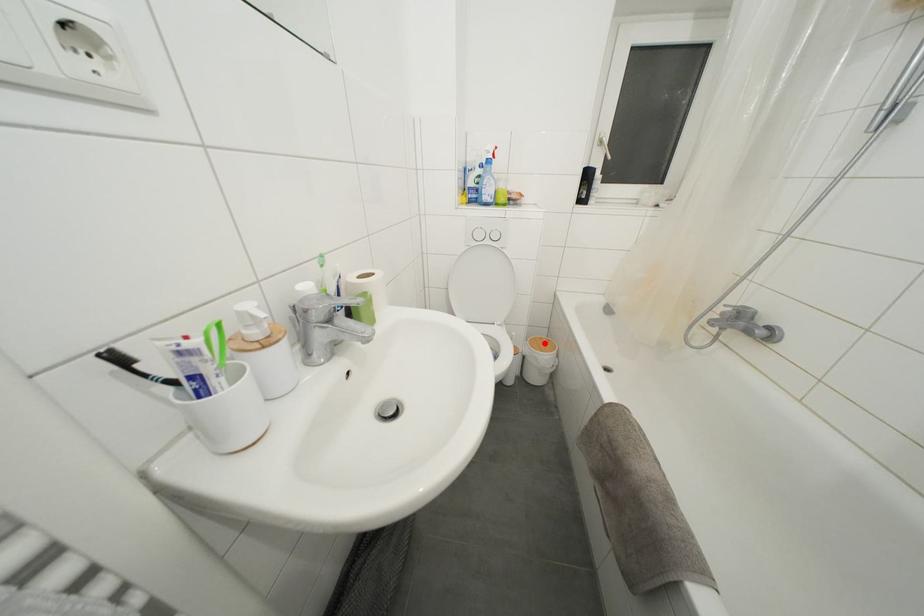
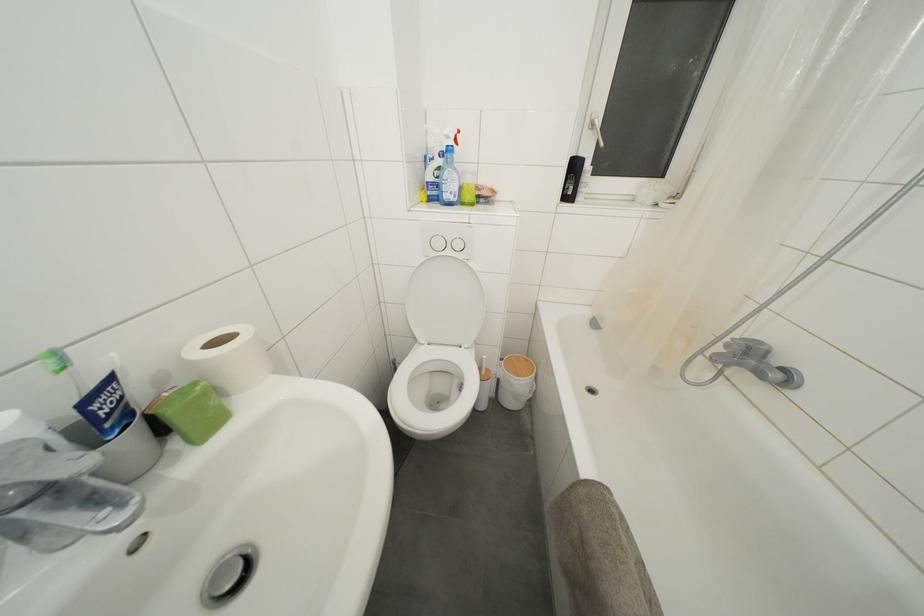
Locate, in the second image, the point that corresponds to the highlighted location in the first image.

(521, 362)